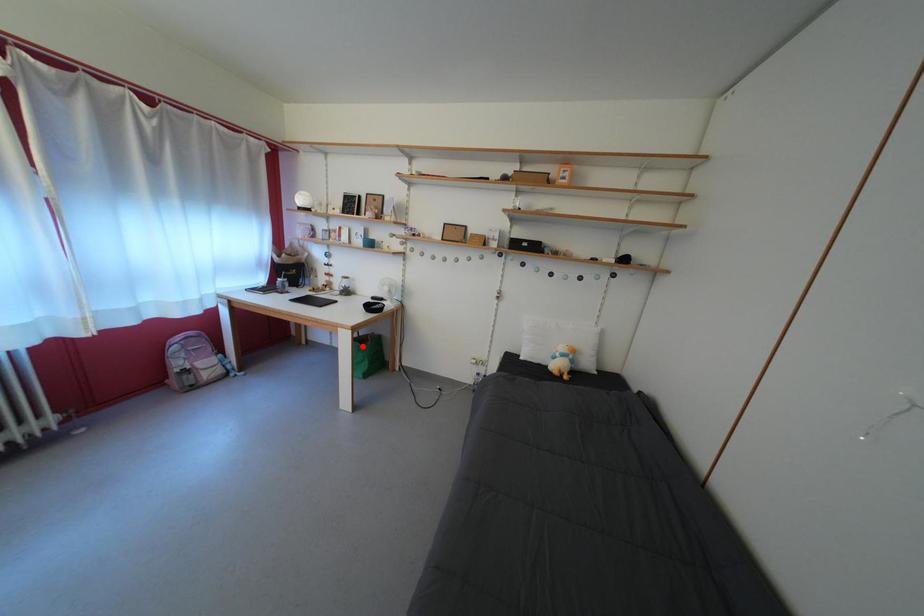
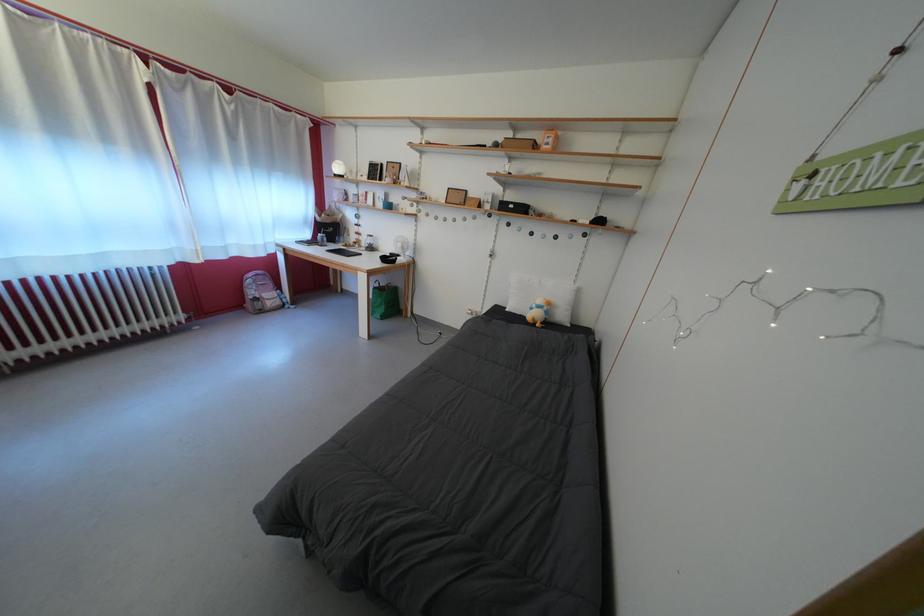
Question: I am providing you with two images of the same scene from different viewpoints. In image1, a red point is highlighted. Considering the same 3D point in image2, which of the following is correct?

Choices:
 (A) It is closer
 (B) It is farther

Answer: (A)